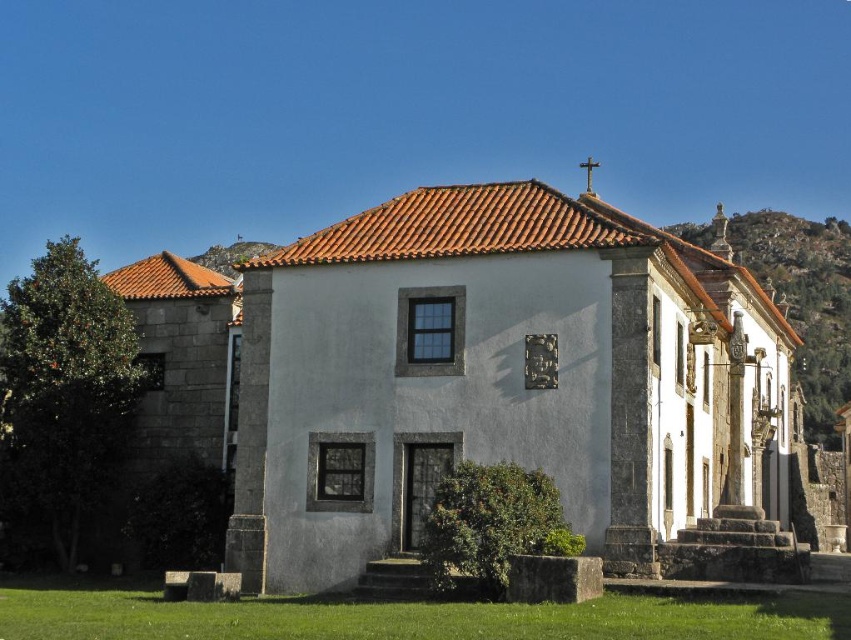
You are an architect designing a new garden path that needs to pass between the white stone chapel at center and the rustic stone hillside at upper right. Which side of the path should be closer to the chapel to ensure the path remains wider on the chapel side?

The white stone chapel at center is wider than the rustic stone hillside at upper right, so placing the path closer to the chapel would allow the path to remain wider on the chapel side.

You are standing in front of the white stone chapel at center and want to walk towards the rustic stone hillside at upper right. Which direction should you move relative to the chapel?

You should move to the right relative to the white stone chapel at center because the rustic stone hillside at upper right is located to the right of the chapel.